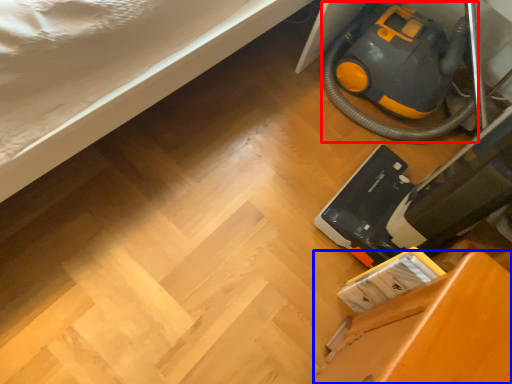
Question: Which object appears closest to the camera in this image, equipment (highlighted by a red box) or furniture (highlighted by a blue box)?

Choices:
 (A) equipment
 (B) furniture

Answer: (B)